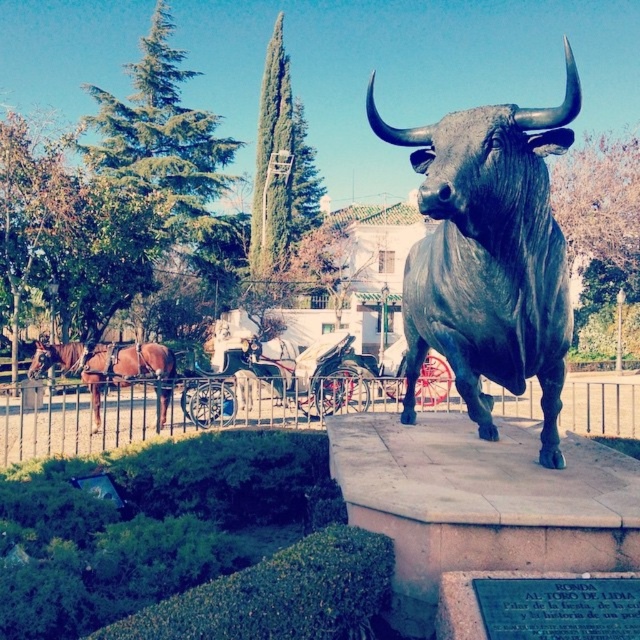
Question: Which point is farther to the camera?

Choices:
 (A) brown leather horse at left
 (B) shiny bronze bull at center

Answer: (A)

Question: Which point is closer to the camera?

Choices:
 (A) (477, 378)
 (B) (68, 348)

Answer: (A)

Question: Where is shiny bronze bull at center located in relation to brown leather horse at left in the image?

Choices:
 (A) left
 (B) right

Answer: (B)

Question: Can you confirm if shiny bronze bull at center is bigger than brown leather horse at left?

Choices:
 (A) no
 (B) yes

Answer: (B)

Question: Can you confirm if shiny bronze bull at center is positioned to the left of brown leather horse at left?

Choices:
 (A) yes
 (B) no

Answer: (B)